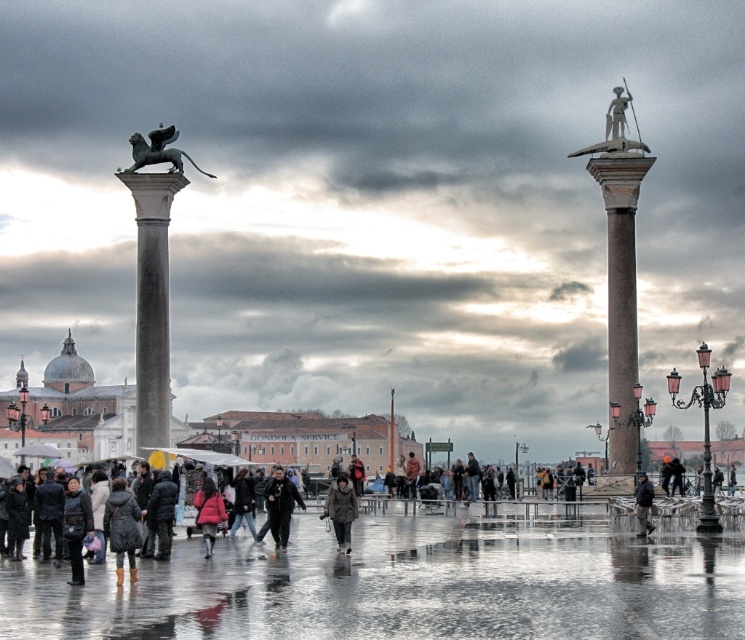
You are a tourist standing at the entrance of St. Mark Square. You see the black polished lion at upper left and the matte pink coat at center. Which object takes up more space in the image?

The matte pink coat at center occupies more space than the black polished lion at upper left.

You are a tourist in St. Mark Square. You see a black polished lion at upper left and a matte pink coat at center. Which object is closer to you? Please explain based on their positions.

The black polished lion at upper left is closer to you because the matte pink coat at center is behind it.